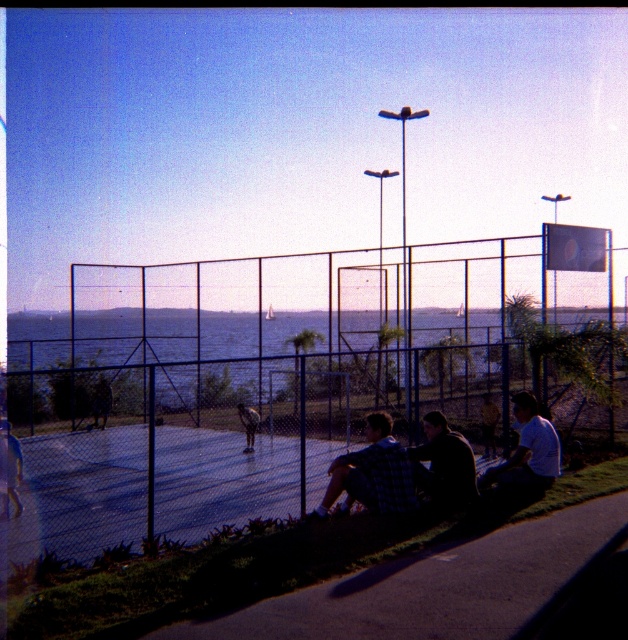
You are a photographer trying to capture a wide shot of the scene. You notice the blue wire mesh fence at center and the light blue shirt at lower right. Which object should you focus on first if you want to ensure both are in sharp focus?

The blue wire mesh fence at center is larger in size than the light blue shirt at lower right, so focusing on the larger object first would help ensure both are in sharp focus.

You are standing in the outdoor scene and want to walk from the blue wire mesh fence at center to the light blue shirt at lower right. Which direction should you head?

To move from the blue wire mesh fence at center to the light blue shirt at lower right, you should head to the right since the blue wire mesh fence at center is positioned to the left of the light blue shirt at lower right.